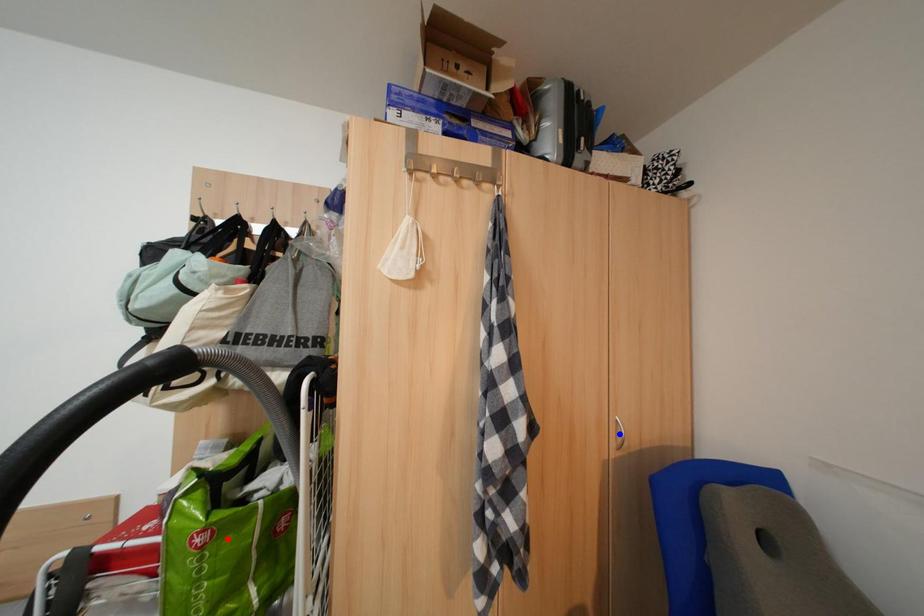
Question: In the image, two points are highlighted. Which point is nearer to the camera? Reply with the corresponding letter.

Choices:
 (A) blue point
 (B) red point

Answer: (B)